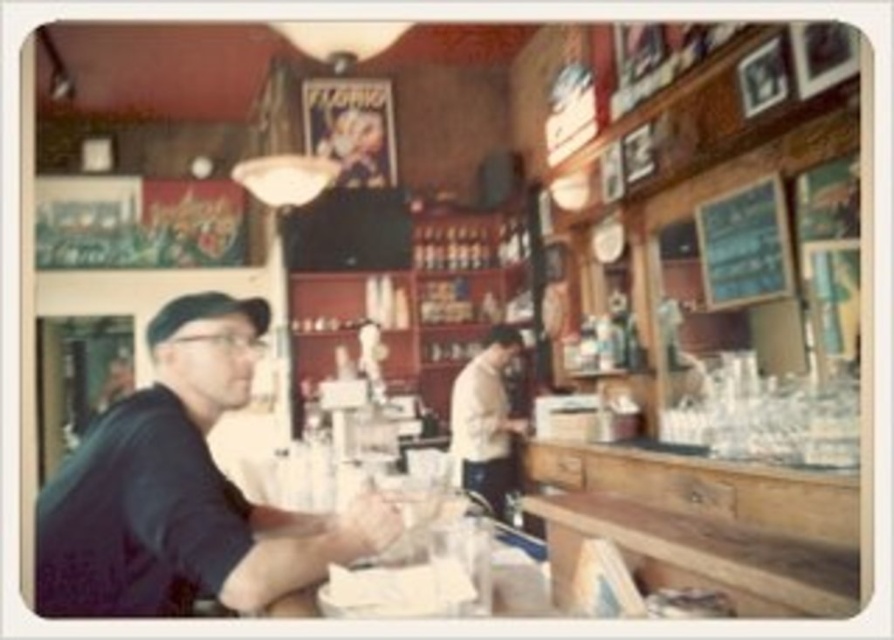
You are standing in the center of the image and want to greet the person wearing the dark blue shirt at left. In which direction should you walk to reach them?

The dark blue shirt at left is located at point 0.766 on the x and 0.205 on the y, so you should walk to the left and slightly forward to reach them.